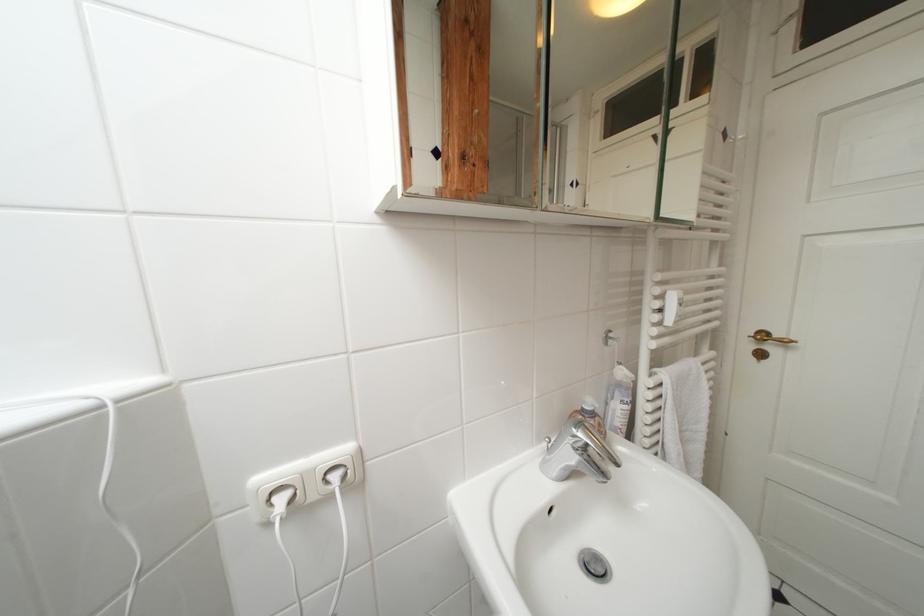
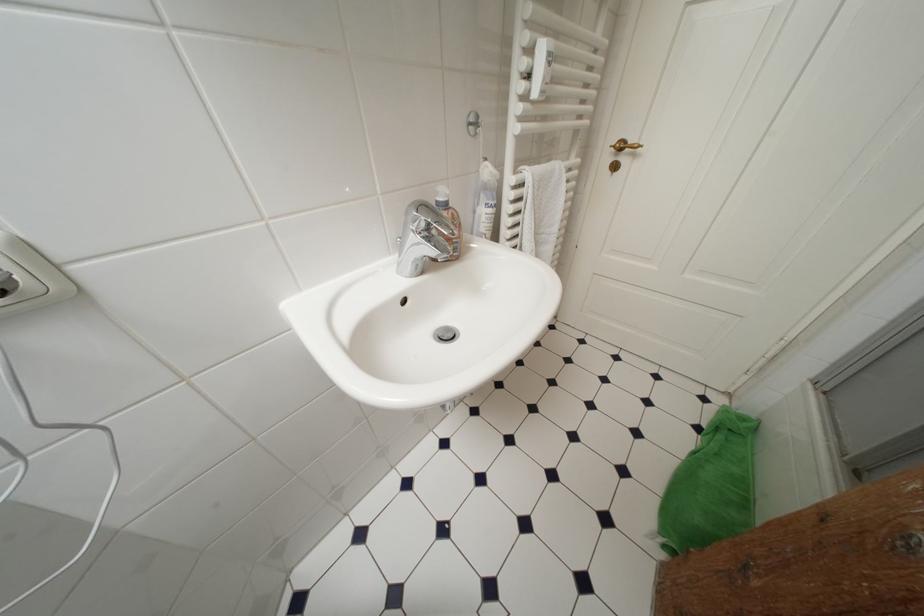
Looking at this image, the first image is from the beginning of the video and the second image is from the end. How did the camera likely rotate when shooting the video?

The camera's rotation is toward right-down.